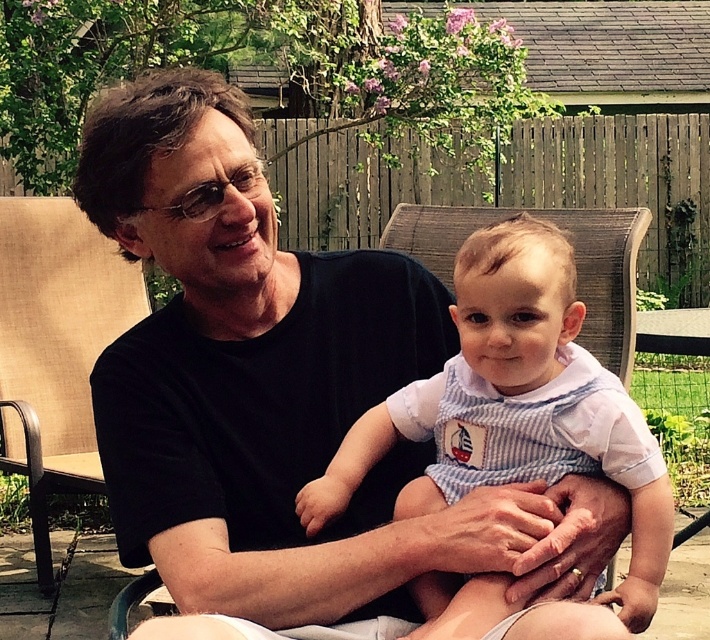
Question: Does black matte shirt at center lie behind blue striped overalls at center?

Choices:
 (A) no
 (B) yes

Answer: (A)

Question: Can you confirm if black matte shirt at center is positioned below blue striped overalls at center?

Choices:
 (A) yes
 (B) no

Answer: (B)

Question: Which of the following is the closest to the observer?

Choices:
 (A) (574, 310)
 (B) (226, 611)

Answer: (B)

Question: Observing the image, what is the correct spatial positioning of black matte shirt at center in reference to blue striped overalls at center?

Choices:
 (A) right
 (B) left

Answer: (B)